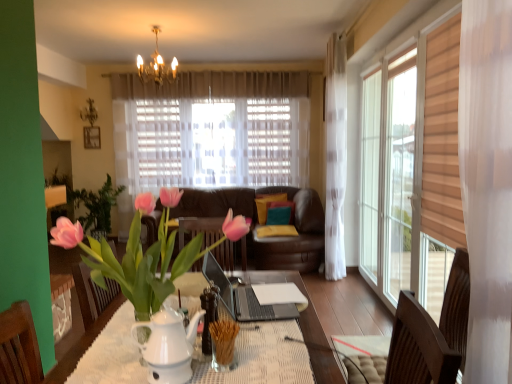
This screenshot has height=384, width=512. Identify the location of gold crystal chandelier at upper center. (156, 66).

In order to face wooden picture frame at upper left, should I rotate leftwards or rightwards?

To align with it, rotate left about 20.845°.

The image size is (512, 384). What do you see at coordinates (267, 204) in the screenshot? I see `velvet yellow pillow at center, the second pillow from the front` at bounding box center [267, 204].

Find the location of a particular element. The height and width of the screenshot is (384, 512). velvet yellow pillow at center, the second pillow from the front is located at coordinates (267, 204).

The width and height of the screenshot is (512, 384). In order to click on pink glossy tulip at center in this screenshot , I will do `click(145, 253)`.

Identify the location of gold crystal chandelier at upper center. The width and height of the screenshot is (512, 384). (156, 66).

Is velvet teal pillow at center, arranged as the 1th pillow when viewed from the front, a part of pink glossy tulip at center?

No, velvet teal pillow at center, arranged as the 1th pillow when viewed from the front, is not a part of pink glossy tulip at center.

Considering the positions of objects pink glossy tulip at center and velvet teal pillow at center, the 2th pillow viewed from the back, in the image provided, who is more to the right, pink glossy tulip at center or velvet teal pillow at center, the 2th pillow viewed from the back,?

From the viewer's perspective, velvet teal pillow at center, the 2th pillow viewed from the back, appears more on the right side.

From the image's perspective, is pink glossy tulip at center above or below velvet teal pillow at center, arranged as the 1th pillow when viewed from the front?

Clearly, from the image's perspective, pink glossy tulip at center is above velvet teal pillow at center, arranged as the 1th pillow when viewed from the front.

Is velvet yellow pillow at center, placed as the first pillow when sorted from back to front, completely or partially outside of gold crystal chandelier at upper center?

velvet yellow pillow at center, placed as the first pillow when sorted from back to front, lies outside gold crystal chandelier at upper center's area.

From a real-world perspective, between velvet yellow pillow at center, the second pillow from the front, and gold crystal chandelier at upper center, who is vertically lower?

From a 3D spatial view, velvet yellow pillow at center, the second pillow from the front, is below.

Is velvet yellow pillow at center, placed as the first pillow when sorted from back to front, bigger than gold crystal chandelier at upper center?

No.

Consider the image. Which object is wider, velvet yellow pillow at center, placed as the first pillow when sorted from back to front, or gold crystal chandelier at upper center?

gold crystal chandelier at upper center.

Looking at this image, does velvet teal pillow at center, arranged as the 1th pillow when viewed from the front, appear on the right side of velvet yellow pillow at center, placed as the first pillow when sorted from back to front?

Indeed, velvet teal pillow at center, arranged as the 1th pillow when viewed from the front, is positioned on the right side of velvet yellow pillow at center, placed as the first pillow when sorted from back to front.

Which is in front, point (273, 211) or point (273, 197)?

Positioned in front is point (273, 211).

Considering the relative sizes of velvet teal pillow at center, the 2th pillow viewed from the back, and velvet yellow pillow at center, the second pillow from the front, in the image provided, is velvet teal pillow at center, the 2th pillow viewed from the back, shorter than velvet yellow pillow at center, the second pillow from the front,?

Yes, velvet teal pillow at center, the 2th pillow viewed from the back, is shorter than velvet yellow pillow at center, the second pillow from the front.

Is velvet yellow pillow at center, placed as the first pillow when sorted from back to front, at the left side of velvet teal pillow at center, arranged as the 1th pillow when viewed from the front?

Yes.

Is velvet yellow pillow at center, placed as the first pillow when sorted from back to front, wider or thinner than velvet teal pillow at center, the 2th pillow viewed from the back?

velvet yellow pillow at center, placed as the first pillow when sorted from back to front, is wider than velvet teal pillow at center, the 2th pillow viewed from the back.

Looking at this image, from a real-world perspective, is velvet yellow pillow at center, placed as the first pillow when sorted from back to front, physically above velvet teal pillow at center, arranged as the 1th pillow when viewed from the front?

Yes.

Can velvet teal pillow at center, arranged as the 1th pillow when viewed from the front, be found inside velvet yellow pillow at center, placed as the first pillow when sorted from back to front?

That's incorrect, velvet teal pillow at center, arranged as the 1th pillow when viewed from the front, is not inside velvet yellow pillow at center, placed as the first pillow when sorted from back to front.

How different are the orientations of velvet yellow pillow at center, placed as the first pillow when sorted from back to front, and wooden picture frame at upper left in degrees?

8.17 degrees.

The image size is (512, 384). Identify the location of picture frame that is above the velvet yellow pillow at center, placed as the first pillow when sorted from back to front (from the image's perspective). (92, 137).

Between velvet yellow pillow at center, placed as the first pillow when sorted from back to front, and wooden picture frame at upper left, which one has smaller size?

wooden picture frame at upper left.

Is velvet yellow pillow at center, the second pillow from the front, shorter than wooden picture frame at upper left?

No.

From the image's perspective, which one is positioned lower, velvet teal pillow at center, arranged as the 1th pillow when viewed from the front, or pink glossy tulip at center?

From the image's view, velvet teal pillow at center, arranged as the 1th pillow when viewed from the front, is below.

Is the position of velvet teal pillow at center, the 2th pillow viewed from the back, more distant than that of pink glossy tulip at center?

Yes, velvet teal pillow at center, the 2th pillow viewed from the back, is further from the camera.

From a real-world perspective, is velvet teal pillow at center, arranged as the 1th pillow when viewed from the front, above or below pink glossy tulip at center?

velvet teal pillow at center, arranged as the 1th pillow when viewed from the front, is situated lower than pink glossy tulip at center in the real world.

Image resolution: width=512 pixels, height=384 pixels. In order to click on houseplant below the velvet yellow pillow at center, the second pillow from the front (from the image's perspective) in this screenshot , I will do `click(145, 253)`.

Measure the distance from velvet yellow pillow at center, the second pillow from the front, to pink glossy tulip at center.

velvet yellow pillow at center, the second pillow from the front, is 3.99 meters away from pink glossy tulip at center.

Is velvet yellow pillow at center, placed as the first pillow when sorted from back to front, looking in the opposite direction of pink glossy tulip at center?

That's not correct — velvet yellow pillow at center, placed as the first pillow when sorted from back to front, is not looking away from pink glossy tulip at center.

Does velvet yellow pillow at center, placed as the first pillow when sorted from back to front, have a lesser height compared to pink glossy tulip at center?

Correct, velvet yellow pillow at center, placed as the first pillow when sorted from back to front, is not as tall as pink glossy tulip at center.

This screenshot has width=512, height=384. I want to click on houseplant that is above the velvet teal pillow at center, the 2th pillow viewed from the back (from a real-world perspective), so click(145, 253).

Identify the location of lamp that appears in front of the velvet yellow pillow at center, the second pillow from the front. (156, 66).

Looking at the image, which one is located further to pink glossy tulip at center, gold crystal chandelier at upper center or wooden picture frame at upper left?

wooden picture frame at upper left is further to pink glossy tulip at center.

From the image, which object appears to be nearer to velvet teal pillow at center, the 2th pillow viewed from the back, velvet yellow pillow at center, the second pillow from the front, or wooden picture frame at upper left?

velvet yellow pillow at center, the second pillow from the front, is closer to velvet teal pillow at center, the 2th pillow viewed from the back.

Considering their positions, is velvet teal pillow at center, arranged as the 1th pillow when viewed from the front, positioned further to gold crystal chandelier at upper center than wooden picture frame at upper left?

velvet teal pillow at center, arranged as the 1th pillow when viewed from the front, lies further to gold crystal chandelier at upper center than the other object.

Which object lies nearer to the anchor point gold crystal chandelier at upper center, pink glossy tulip at center or velvet yellow pillow at center, the second pillow from the front?

velvet yellow pillow at center, the second pillow from the front, lies closer to gold crystal chandelier at upper center than the other object.

From the image, which object appears to be farther from gold crystal chandelier at upper center, wooden picture frame at upper left or velvet yellow pillow at center, the second pillow from the front?

Among the two, velvet yellow pillow at center, the second pillow from the front, is located further to gold crystal chandelier at upper center.

From the image, which object appears to be farther from velvet teal pillow at center, arranged as the 1th pillow when viewed from the front, gold crystal chandelier at upper center or wooden picture frame at upper left?

wooden picture frame at upper left lies further to velvet teal pillow at center, arranged as the 1th pillow when viewed from the front, than the other object.

From the image, which object appears to be nearer to pink glossy tulip at center, wooden picture frame at upper left or gold crystal chandelier at upper center?

gold crystal chandelier at upper center is positioned closer to the anchor pink glossy tulip at center.

Estimate the real-world distances between objects in this image. Which object is closer to pink glossy tulip at center, velvet teal pillow at center, arranged as the 1th pillow when viewed from the front, or wooden picture frame at upper left?

velvet teal pillow at center, arranged as the 1th pillow when viewed from the front, is positioned closer to the anchor pink glossy tulip at center.

Locate an element on the screen. pillow between pink glossy tulip at center and velvet yellow pillow at center, the second pillow from the front, in the front-back direction is located at coordinates (280, 213).

Where is `lamp between pink glossy tulip at center and velvet yellow pillow at center, placed as the first pillow when sorted from back to front, along the z-axis`? Image resolution: width=512 pixels, height=384 pixels. lamp between pink glossy tulip at center and velvet yellow pillow at center, placed as the first pillow when sorted from back to front, along the z-axis is located at coordinates (156, 66).

The height and width of the screenshot is (384, 512). What are the coordinates of `lamp between wooden picture frame at upper left and velvet yellow pillow at center, the second pillow from the front, in the horizontal direction` in the screenshot? It's located at (156, 66).

The width and height of the screenshot is (512, 384). In order to click on pillow between wooden picture frame at upper left and velvet teal pillow at center, arranged as the 1th pillow when viewed from the front, in the horizontal direction in this screenshot , I will do `click(267, 204)`.